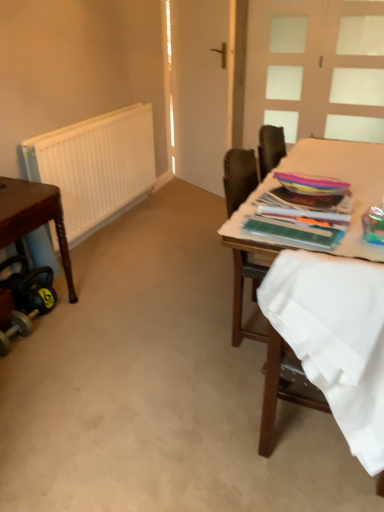
Question: Is wooden chair at right aimed at multicolored plastic magazine at right?

Choices:
 (A) yes
 (B) no

Answer: (B)

Question: Would you consider wooden chair at right to be distant from multicolored plastic magazine at right?

Choices:
 (A) yes
 (B) no

Answer: (B)

Question: Does wooden chair at right have a lesser height compared to multicolored plastic magazine at right?

Choices:
 (A) no
 (B) yes

Answer: (A)

Question: Can you confirm if wooden chair at right is wider than multicolored plastic magazine at right?

Choices:
 (A) no
 (B) yes

Answer: (B)

Question: Does wooden chair at right lie in front of multicolored plastic magazine at right?

Choices:
 (A) no
 (B) yes

Answer: (B)

Question: From a real-world perspective, is wooden chair at right under multicolored plastic magazine at right?

Choices:
 (A) no
 (B) yes

Answer: (B)

Question: Does multicolored plastic magazine at right have a larger size compared to white matte radiator at left?

Choices:
 (A) no
 (B) yes

Answer: (A)

Question: From the image's perspective, is multicolored plastic magazine at right below white matte radiator at left?

Choices:
 (A) no
 (B) yes

Answer: (B)

Question: Is multicolored plastic magazine at right further to the viewer compared to white matte radiator at left?

Choices:
 (A) no
 (B) yes

Answer: (A)

Question: From a real-world perspective, is multicolored plastic magazine at right on white matte radiator at left?

Choices:
 (A) no
 (B) yes

Answer: (B)

Question: Is multicolored plastic magazine at right in front of white matte radiator at left?

Choices:
 (A) yes
 (B) no

Answer: (A)

Question: Is multicolored plastic magazine at right positioned with its back to white matte radiator at left?

Choices:
 (A) yes
 (B) no

Answer: (B)

Question: From the image's perspective, is white frosted glass door at upper right on wooden table at right?

Choices:
 (A) yes
 (B) no

Answer: (A)